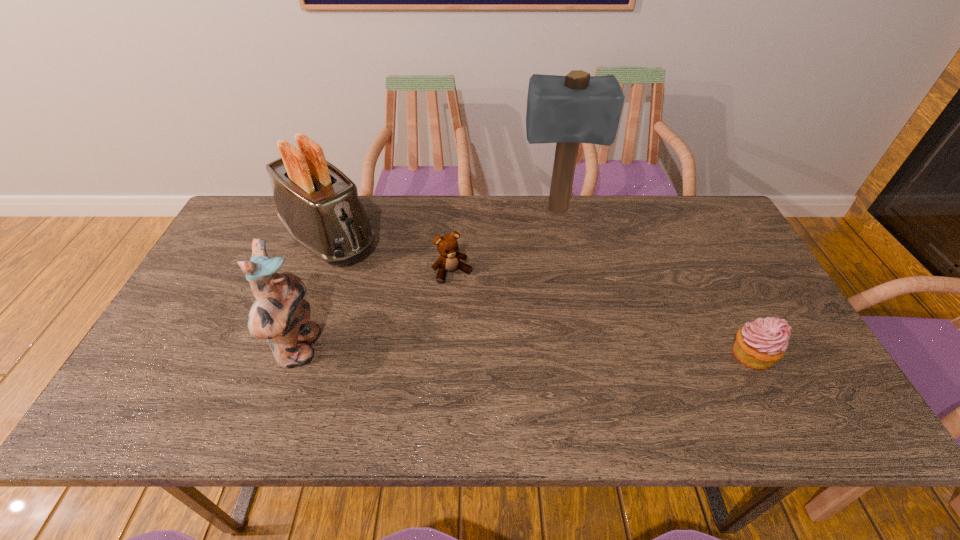
This screenshot has height=540, width=960. I want to click on free spot located 0.190m on the front-facing side of the teddy bear, so click(x=492, y=333).

Locate an element on the screen. This screenshot has width=960, height=540. vacant space situated 0.160m on the side of the toaster with the control lever is located at coordinates (392, 293).

Locate an element on the screen. Image resolution: width=960 pixels, height=540 pixels. free space located 0.090m on the side of the toaster with the control lever is located at coordinates (376, 280).

At what (x,y) coordinates should I click in order to perform the action: click on free spot located 0.240m on the side of the toaster with the control lever. Please return your answer as a coordinate pair (x, y). Image resolution: width=960 pixels, height=540 pixels. Looking at the image, I should click on (410, 308).

The width and height of the screenshot is (960, 540). I want to click on vacant position located on the striking surface of the mallet, so pyautogui.click(x=564, y=282).

I want to click on free spot located 0.220m on the striking surface of the mallet, so click(563, 275).

Locate an element on the screen. The width and height of the screenshot is (960, 540). free space located on the striking surface of the mallet is located at coordinates (565, 299).

Locate an element on the screen. toaster at the far edge is located at coordinates (318, 204).

You are a GUI agent. You are given a task and a screenshot of the screen. Output one action in this format:
    pyautogui.click(x=<x>, y=<y>)
    Task: Click on the mallet positioned at the far edge
    
    Given the screenshot: What is the action you would take?
    pyautogui.click(x=577, y=108)

Where is `figurine that is positioned at the near edge`? This screenshot has height=540, width=960. figurine that is positioned at the near edge is located at coordinates pyautogui.click(x=279, y=313).